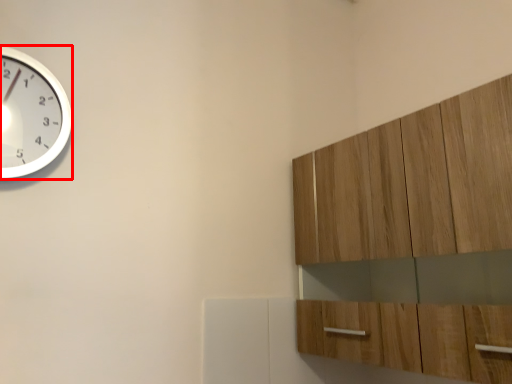
Question: Where is wall clock (annotated by the red box) located in relation to cabinetry in the image?

Choices:
 (A) left
 (B) right

Answer: (A)